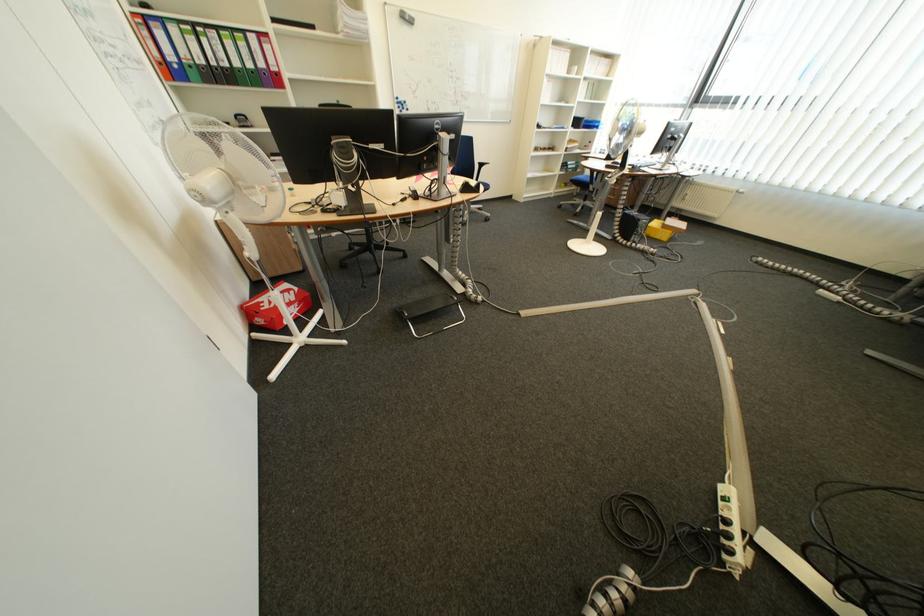
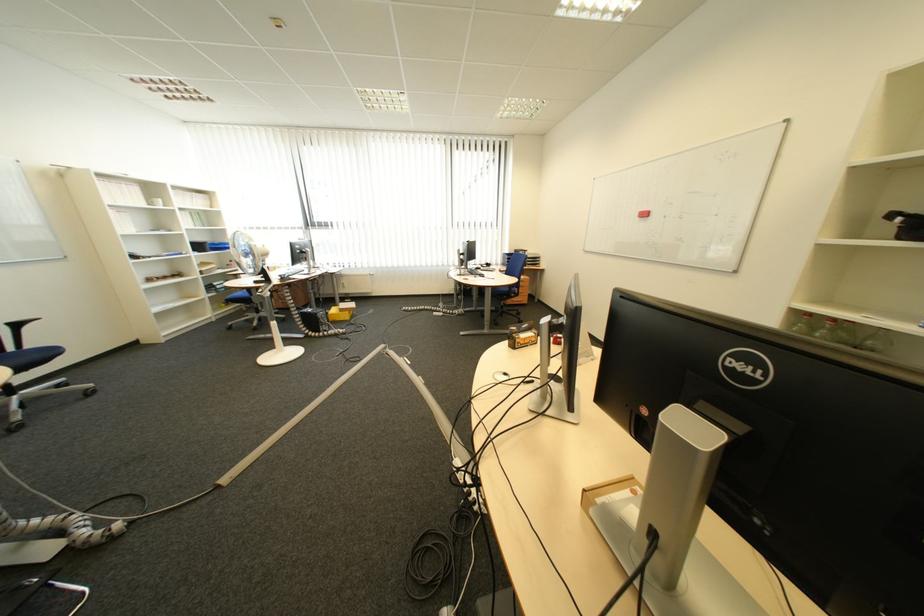
Locate, in the second image, the point that corresponds to pixel 657 227 in the first image.

(335, 317)